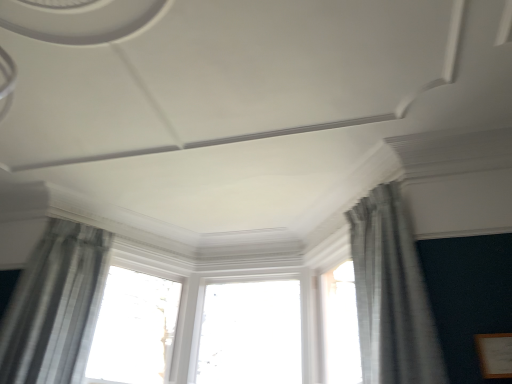
Question: Considering the positions of point (392, 354) and point (119, 337), is point (392, 354) closer or farther from the camera than point (119, 337)?

Choices:
 (A) closer
 (B) farther

Answer: (A)

Question: Would you say gray sheer curtain at upper right, the 2th curtain positioned from the left, is inside or outside white glossy window at center?

Choices:
 (A) inside
 (B) outside

Answer: (B)

Question: Considering the real-world distances, which object is closest to the sheer gray curtain at left, the 1th curtain positioned from the left?

Choices:
 (A) gray sheer curtain at upper right, the 2th curtain positioned from the left
 (B) white glossy window at center

Answer: (B)

Question: Which object is the closest to the sheer gray curtain at left, the 1th curtain positioned from the left?

Choices:
 (A) white glossy window at center
 (B) gray sheer curtain at upper right, acting as the 1th curtain starting from the right

Answer: (A)